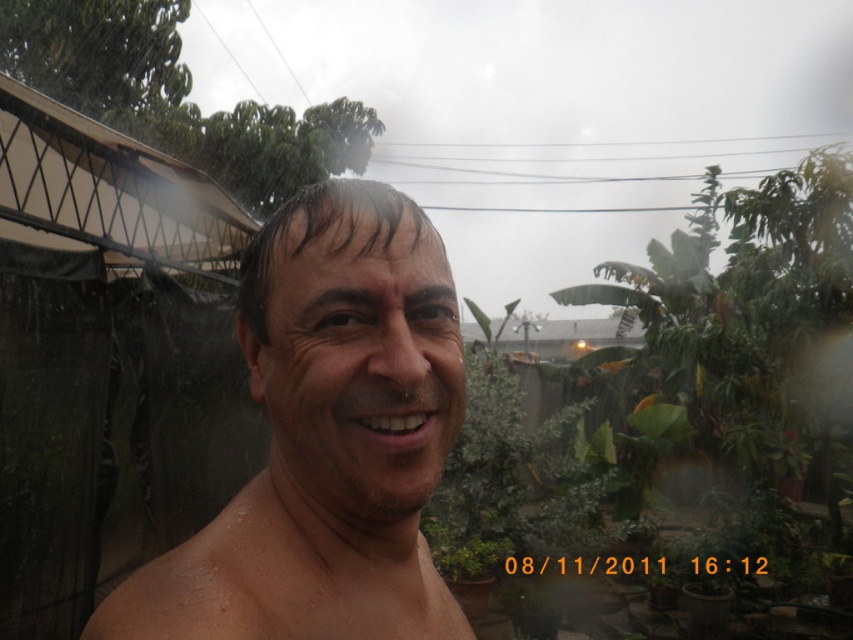
You are a photographer trying to capture both the wet skin face at center and the green leafy plant at center in the same frame. Which object should you focus on first to ensure both are in the frame without moving the camera?

You should focus on the green leafy plant at center first because it is taller than the wet skin face at center, allowing the shorter face to fit within the frame more easily.

You are a photographer trying to capture the man in the rain. You notice the wet skin face at center and the green leafy plant at center. Which object is positioned to the left?

The wet skin face at center is positioned to the left of the green leafy plant at center.